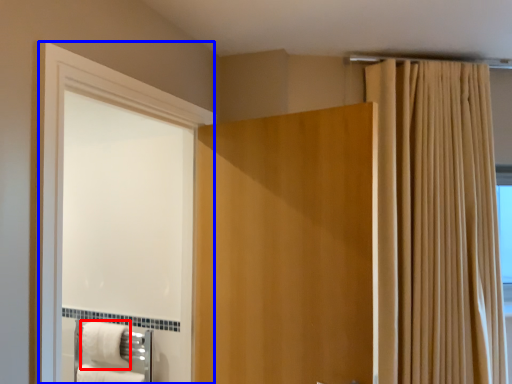
Question: Which object is further to the camera taking this photo, bath towel (highlighted by a red box) or screen door (highlighted by a blue box)?

Choices:
 (A) bath towel
 (B) screen door

Answer: (A)